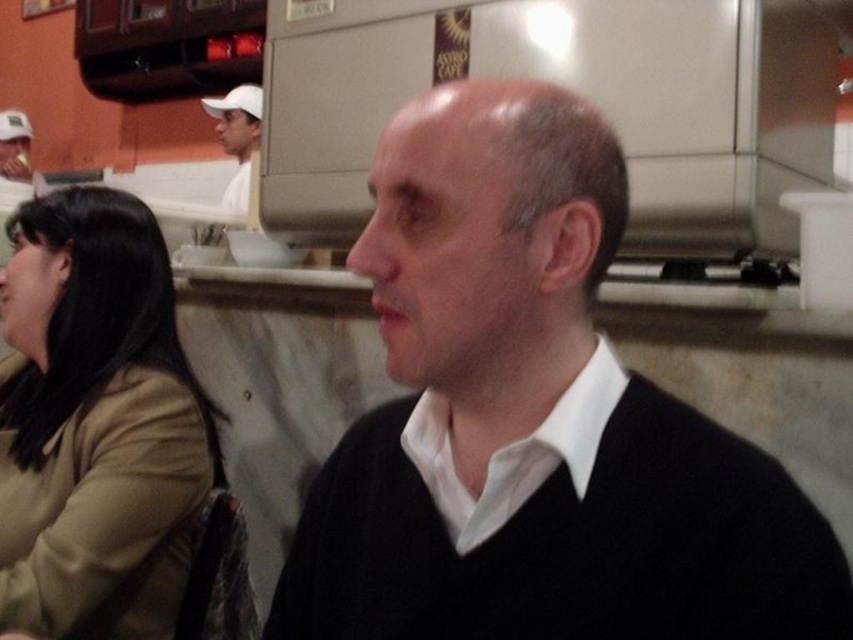
Is black matte sweater at center bigger than tan fabric coat at left?

Incorrect, black matte sweater at center is not larger than tan fabric coat at left.

Does black matte sweater at center have a smaller size compared to tan fabric coat at left?

Correct, black matte sweater at center occupies less space than tan fabric coat at left.

What do you see at coordinates (532, 420) in the screenshot? This screenshot has width=853, height=640. I see `black matte sweater at center` at bounding box center [532, 420].

You are a GUI agent. You are given a task and a screenshot of the screen. Output one action in this format:
    pyautogui.click(x=<x>, y=<y>)
    Task: Click on the black matte sweater at center
    This screenshot has width=853, height=640.
    Given the screenshot: What is the action you would take?
    pyautogui.click(x=532, y=420)

Is white cap at upper left wider than matte white cap at upper left?

Yes.

Where is `white cap at upper left`? Image resolution: width=853 pixels, height=640 pixels. white cap at upper left is located at coordinates (236, 138).

Which is behind, point (254, 102) or point (10, 170)?

The point (10, 170) is behind.

Identify the location of white cap at upper left. Image resolution: width=853 pixels, height=640 pixels. (236, 138).

Does tan fabric coat at left appear on the left side of white cap at upper left?

No, tan fabric coat at left is not to the left of white cap at upper left.

Between point (33, 275) and point (231, 141), which one is positioned behind?

The point (231, 141) is behind.

Between point (50, 458) and point (231, 108), which one is positioned in front?

Point (50, 458) is in front.

The image size is (853, 640). What are the coordinates of `tan fabric coat at left` in the screenshot? It's located at (96, 422).